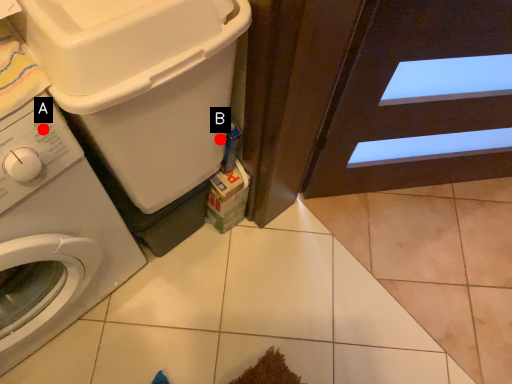
Question: Two points are circled on the image, labeled by A and B beside each circle. Which point is closer to the camera?

Choices:
 (A) A is closer
 (B) B is closer

Answer: (A)